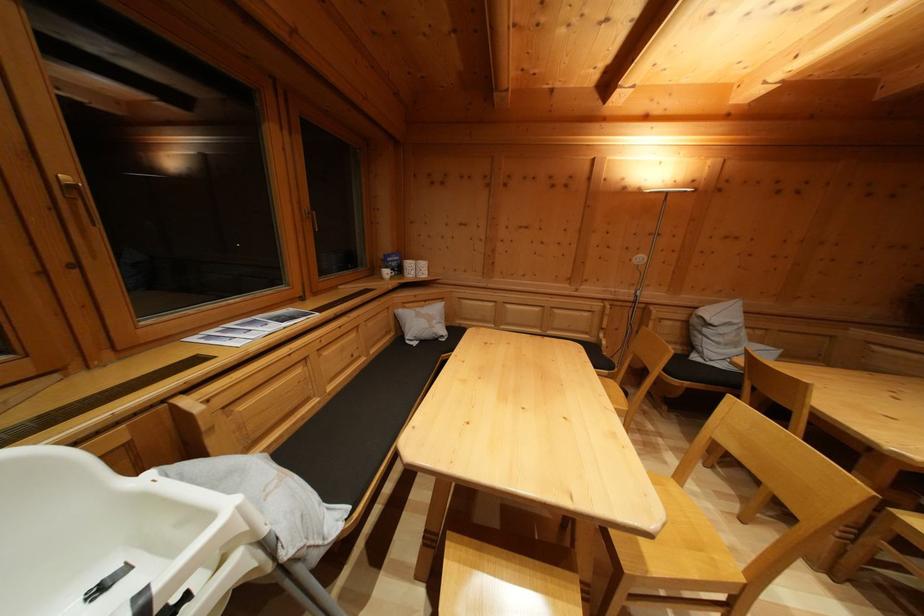
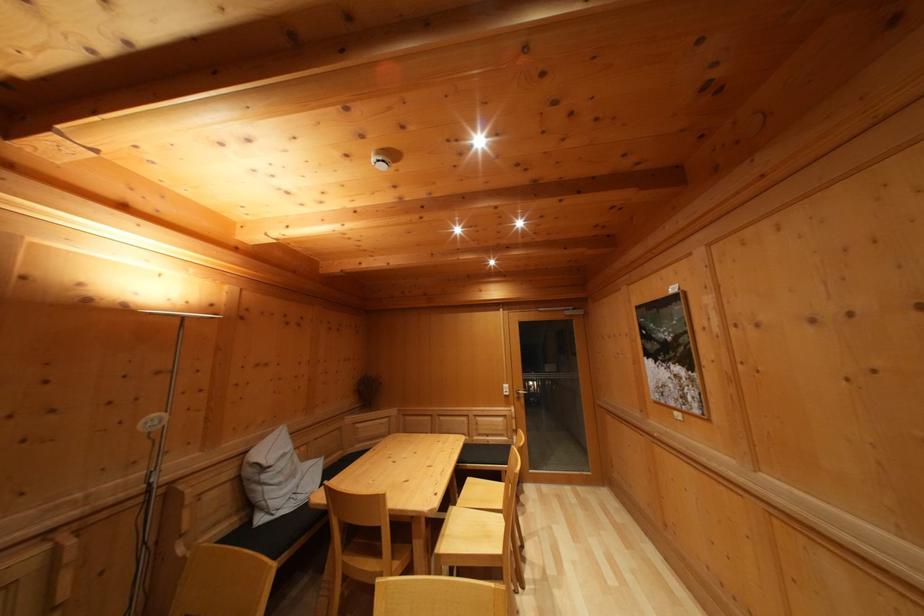
Question: Based on the continuous images, in which direction is the camera rotating? Reply with the corresponding letter.

Choices:
 (A) Left
 (B) Right
 (C) Up
 (D) Down

Answer: (B)